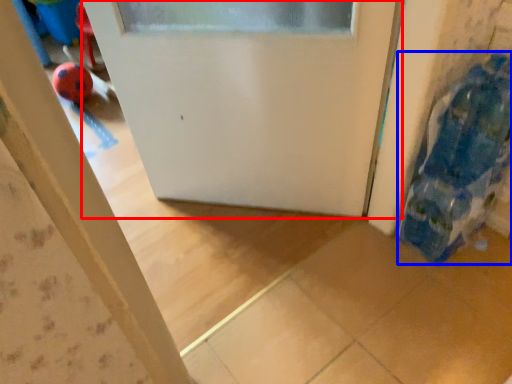
Question: Which object appears farthest to the camera in this image, door (highlighted by a red box) or toy (highlighted by a blue box)?

Choices:
 (A) door
 (B) toy

Answer: (A)